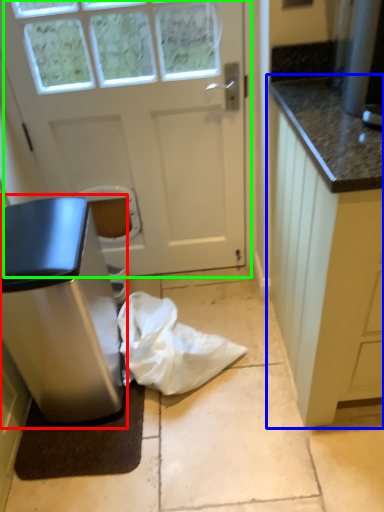
Question: Which object is the farthest from home appliance (highlighted by a red box)? Choose among these: cabinetry (highlighted by a blue box) or door (highlighted by a green box).

Choices:
 (A) cabinetry
 (B) door

Answer: (A)